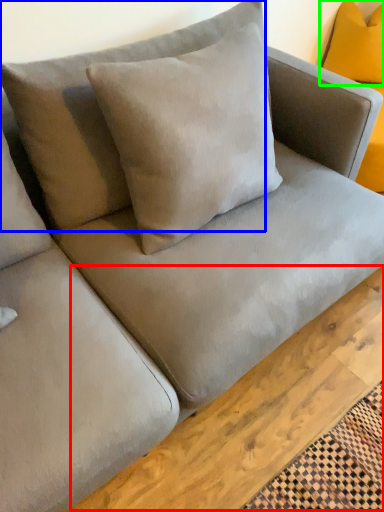
Question: Which is farther away from plank (highlighted by a red box)? pillow (highlighted by a blue box) or pillow (highlighted by a green box)?

Choices:
 (A) pillow
 (B) pillow

Answer: (B)